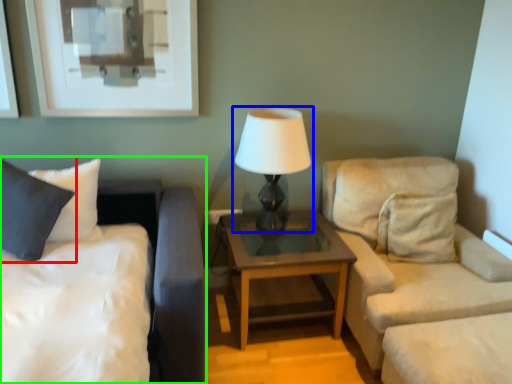
Question: Estimate the real-world distances between objects in this image. Which object is closer to pillow (highlighted by a red box), lamp (highlighted by a blue box) or bed (highlighted by a green box)?

Choices:
 (A) lamp
 (B) bed

Answer: (B)